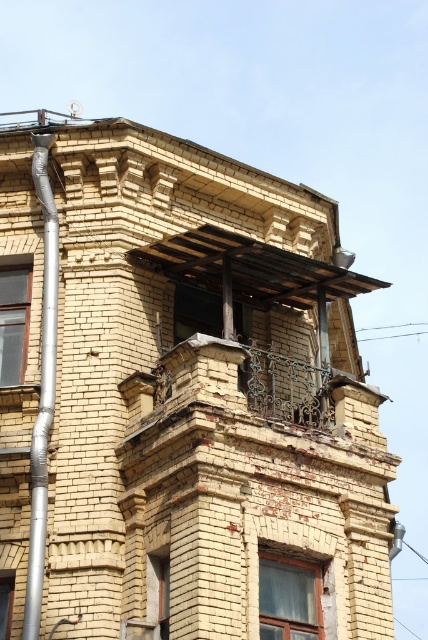
Question: Is matte glass window at center above clear glass window at left?

Choices:
 (A) yes
 (B) no

Answer: (B)

Question: Considering the relative positions of clear glass window at left and matte glass window at upper center in the image provided, where is clear glass window at left located with respect to matte glass window at upper center?

Choices:
 (A) right
 (B) left

Answer: (B)

Question: Which point appears closest to the camera in this image?

Choices:
 (A) (12, 364)
 (B) (273, 572)

Answer: (B)

Question: Is silver metallic pipe at left positioned before matte glass window at upper center?

Choices:
 (A) yes
 (B) no

Answer: (A)

Question: Which object is closer to the camera taking this photo?

Choices:
 (A) silver metallic pipe at left
 (B) matte glass window at center

Answer: (A)

Question: Which point is farther to the camera?

Choices:
 (A) silver metallic pipe at left
 (B) matte glass window at center
 (C) clear glass window at left
 (D) matte glass window at upper center

Answer: (D)